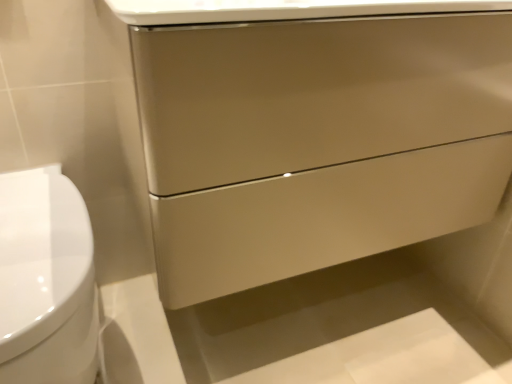
Question: Considering the relative sizes of white glossy toilet at left and matte beige drawer at center in the image provided, is white glossy toilet at left smaller than matte beige drawer at center?

Choices:
 (A) no
 (B) yes

Answer: (B)

Question: From a real-world perspective, is white glossy toilet at left on matte beige drawer at center?

Choices:
 (A) no
 (B) yes

Answer: (A)

Question: Considering the relative positions of white glossy toilet at left and matte beige drawer at center in the image provided, is white glossy toilet at left to the right of matte beige drawer at center from the viewer's perspective?

Choices:
 (A) no
 (B) yes

Answer: (A)

Question: Are white glossy toilet at left and matte beige drawer at center beside each other?

Choices:
 (A) yes
 (B) no

Answer: (B)

Question: Would you say white glossy toilet at left is a long distance from matte beige drawer at center?

Choices:
 (A) no
 (B) yes

Answer: (A)

Question: From the image's perspective, does white glossy toilet at left appear lower than matte beige drawer at center?

Choices:
 (A) yes
 (B) no

Answer: (A)

Question: From a real-world perspective, is matte beige drawer at center positioned under white glossy toilet at left based on gravity?

Choices:
 (A) yes
 (B) no

Answer: (B)

Question: Does matte beige drawer at center lie in front of white glossy toilet at left?

Choices:
 (A) no
 (B) yes

Answer: (A)

Question: Is matte beige drawer at center not close to white glossy toilet at left?

Choices:
 (A) yes
 (B) no

Answer: (B)

Question: Is matte beige drawer at center oriented towards white glossy toilet at left?

Choices:
 (A) yes
 (B) no

Answer: (B)

Question: Is matte beige drawer at center beside white glossy toilet at left?

Choices:
 (A) no
 (B) yes

Answer: (A)

Question: Can white glossy toilet at left be found inside matte beige drawer at center?

Choices:
 (A) no
 (B) yes

Answer: (A)

Question: Would you say matte beige drawer at center is to the left or to the right of white glossy toilet at left in the picture?

Choices:
 (A) left
 (B) right

Answer: (B)